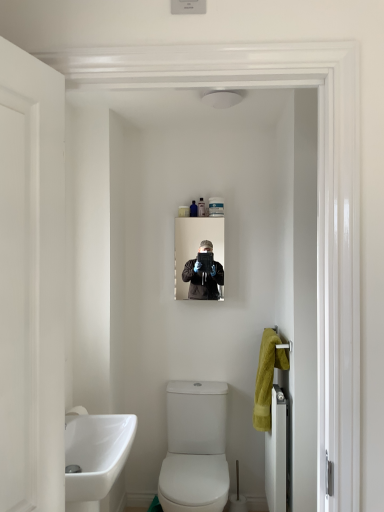
Question: Considering the relative positions of white plastic container at upper center, the fourth toiletry from the right, and white matte door at left, positioned as the 2th door in bottom-to-top order, in the image provided, is white plastic container at upper center, the fourth toiletry from the right, to the left or to the right of white matte door at left, positioned as the 2th door in bottom-to-top order,?

Choices:
 (A) right
 (B) left

Answer: (A)

Question: From the image's perspective, is white plastic container at upper center, the fourth toiletry from the right, located above or below white matte door at left, which is the second door in right-to-left order?

Choices:
 (A) below
 (B) above

Answer: (B)

Question: Which of these objects is positioned closest to the translucent plastic container at upper center, placed as the second toiletry when sorted from right to left?

Choices:
 (A) white glossy towel rack at right, arranged as the 1th door when viewed from the back
 (B) white plastic container at upper center, the 1th toiletry from the left
 (C) clear plastic container at upper center, the 4th toiletry from the left
 (D) translucent plastic bottle at upper center, the 2th toiletry positioned from the left
 (E) matte black mirror at center

Answer: (D)

Question: Which object is the farthest from the white glossy toilet at center?

Choices:
 (A) white matte door at left, the 1th door viewed from the front
 (B) translucent plastic bottle at upper center, the 2th toiletry positioned from the left
 (C) white glossy sink at lower left
 (D) matte black mirror at center
 (E) white glossy towel rack at right, which appears as the first door when viewed from the right

Answer: (A)